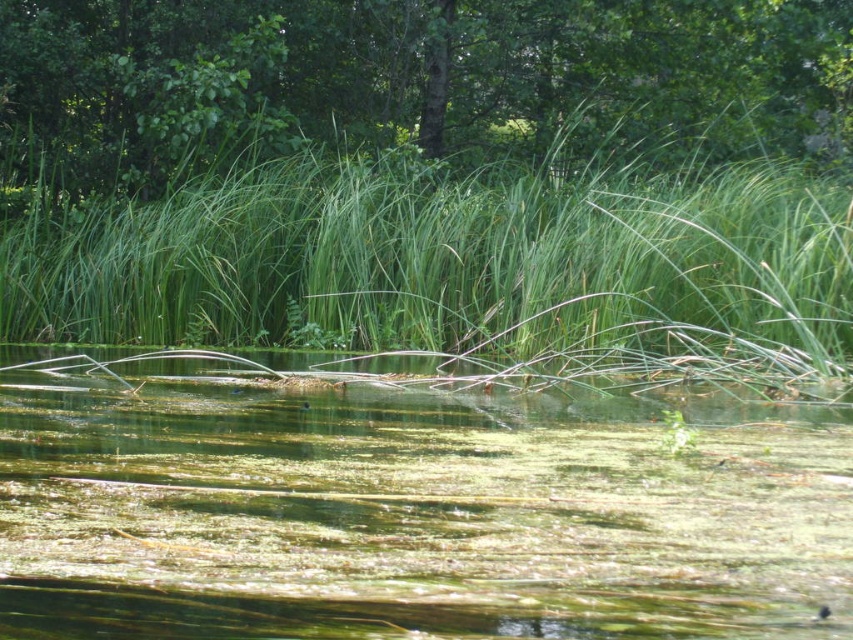
How much distance is there between green algae-covered water at center and green leafy tree at upper center?

green algae-covered water at center and green leafy tree at upper center are 9.38 meters apart from each other.

Can you confirm if green algae-covered water at center is positioned to the left of green leafy tree at upper center?

Indeed, green algae-covered water at center is positioned on the left side of green leafy tree at upper center.

Locate an element on the screen. The width and height of the screenshot is (853, 640). green algae-covered water at center is located at coordinates (412, 513).

Which is more to the right, green grass at center or green leafy tree at upper center?

Positioned to the right is green leafy tree at upper center.

Can you confirm if green grass at center is positioned below green leafy tree at upper center?

Indeed, green grass at center is positioned under green leafy tree at upper center.

Which is behind, point (67, 234) or point (93, 74)?

The point (93, 74) is behind.

Image resolution: width=853 pixels, height=640 pixels. I want to click on green grass at center, so click(x=447, y=264).

Which is in front, point (553, 465) or point (415, 332)?

Point (553, 465)

Can you confirm if green algae-covered water at center is shorter than green grass at center?

Correct, green algae-covered water at center is not as tall as green grass at center.

The height and width of the screenshot is (640, 853). Describe the element at coordinates (412, 513) in the screenshot. I see `green algae-covered water at center` at that location.

This screenshot has width=853, height=640. Identify the location of green algae-covered water at center. click(x=412, y=513).